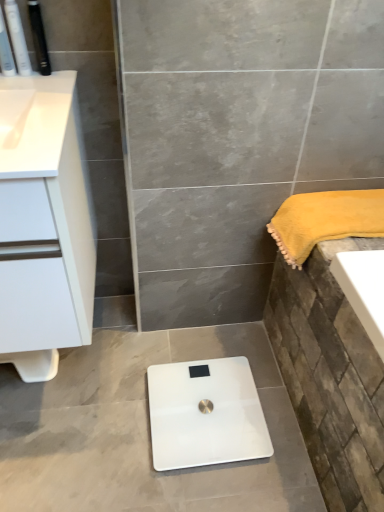
At what (x,y) coordinates should I click in order to perform the action: click on white glossy cabinet at upper left. Please return your answer as a coordinate pair (x, y). The image size is (384, 512). Looking at the image, I should click on (33, 123).

Measure the distance between white glossy cabinet at upper left and camera.

white glossy cabinet at upper left and camera are 71.74 centimeters apart.

Measure the distance between white plastic toothbrushes at upper left, the second toiletry in the left-to-right sequence, and camera.

The depth of white plastic toothbrushes at upper left, the second toiletry in the left-to-right sequence, is 37.50 inches.

Measure the distance between yellow plush towel at right and camera.

yellow plush towel at right and camera are 1.07 meters apart.

What do you see at coordinates (205, 414) in the screenshot? I see `white glossy scale at center` at bounding box center [205, 414].

This screenshot has width=384, height=512. What are the coordinates of `white glossy cabinet at upper left` in the screenshot? It's located at (33, 123).

Is white plastic toothbrushes at upper left, acting as the second toiletry starting from the right, smaller than black plastic toothbrush at upper left, positioned as the third toiletry in left-to-right order?

Actually, white plastic toothbrushes at upper left, acting as the second toiletry starting from the right, might be larger than black plastic toothbrush at upper left, positioned as the third toiletry in left-to-right order.

From the image's perspective, is white plastic toothbrushes at upper left, acting as the second toiletry starting from the right, on black plastic toothbrush at upper left, acting as the 1th toiletry starting from the right?

No, from the image's perspective, white plastic toothbrushes at upper left, acting as the second toiletry starting from the right, is not over black plastic toothbrush at upper left, acting as the 1th toiletry starting from the right.

Based on their positions, is white plastic toothbrushes at upper left, acting as the second toiletry starting from the right, located to the left or right of black plastic toothbrush at upper left, acting as the 1th toiletry starting from the right?

From the image, it's evident that white plastic toothbrushes at upper left, acting as the second toiletry starting from the right, is to the left of black plastic toothbrush at upper left, acting as the 1th toiletry starting from the right.

The width and height of the screenshot is (384, 512). Find the location of `toiletry above the white plastic toothbrushes at upper left, acting as the second toiletry starting from the right (from a real-world perspective)`. toiletry above the white plastic toothbrushes at upper left, acting as the second toiletry starting from the right (from a real-world perspective) is located at coordinates (39, 37).

Can you confirm if black plastic toothbrush at upper left, positioned as the third toiletry in left-to-right order, is positioned to the right of white glossy scale at center?

In fact, black plastic toothbrush at upper left, positioned as the third toiletry in left-to-right order, is to the left of white glossy scale at center.

Based on the photo, does black plastic toothbrush at upper left, acting as the 1th toiletry starting from the right, come behind white glossy scale at center?

No, it is in front of white glossy scale at center.

From a real-world perspective, is black plastic toothbrush at upper left, acting as the 1th toiletry starting from the right, beneath white glossy scale at center?

Incorrect, from a real-world perspective, black plastic toothbrush at upper left, acting as the 1th toiletry starting from the right, is higher than white glossy scale at center.

Could you tell me if black plastic toothbrush at upper left, acting as the 1th toiletry starting from the right, is facing white glossy scale at center?

No, black plastic toothbrush at upper left, acting as the 1th toiletry starting from the right, is not turned towards white glossy scale at center.

Who is taller, yellow plush towel at right or white glossy cabinet at upper left?

yellow plush towel at right.

Looking at this image, which is more to the right, yellow plush towel at right or white glossy cabinet at upper left?

yellow plush towel at right.

From a real-world perspective, does yellow plush towel at right stand above white glossy cabinet at upper left?

No, from a real-world perspective, yellow plush towel at right is not on top of white glossy cabinet at upper left.

Is white glossy cabinet at upper left positioned beyond the bounds of yellow plush towel at right?

Absolutely, white glossy cabinet at upper left is external to yellow plush towel at right.

Could you tell me if white glossy cabinet at upper left is facing yellow plush towel at right?

No, white glossy cabinet at upper left is not oriented towards yellow plush towel at right.

Considering the relative sizes of white glossy cabinet at upper left and yellow plush towel at right in the image provided, is white glossy cabinet at upper left smaller than yellow plush towel at right?

No.

From the image's perspective, does white matte cabinet at left appear lower than white glossy cabinet at upper left?

Indeed, from the image's perspective, white matte cabinet at left is shown beneath white glossy cabinet at upper left.

Is white matte cabinet at left bigger than white glossy cabinet at upper left?

Yes.

Looking at this image, would you say white matte cabinet at left contains white glossy cabinet at upper left?

Yes.

From a real-world perspective, is white matte cabinet at left located beneath black plastic toothbrush at upper left, positioned as the third toiletry in left-to-right order?

Correct, in the physical world, white matte cabinet at left is lower than black plastic toothbrush at upper left, positioned as the third toiletry in left-to-right order.

Is black plastic toothbrush at upper left, positioned as the third toiletry in left-to-right order, at the back of white matte cabinet at left?

That's not correct — white matte cabinet at left is not looking away from black plastic toothbrush at upper left, positioned as the third toiletry in left-to-right order.

Is white matte cabinet at left positioned before black plastic toothbrush at upper left, positioned as the third toiletry in left-to-right order?

Yes, white matte cabinet at left is closer to the camera.

Which of these two, white matte cabinet at left or black plastic toothbrush at upper left, acting as the 1th toiletry starting from the right, is thinner?

black plastic toothbrush at upper left, acting as the 1th toiletry starting from the right, is thinner.

Based on the photo, measure the distance from white glossy cabinet at upper left to matte black toothbrush at upper left, positioned as the first toiletry in left-to-right order.

A distance of 9.26 inches exists between white glossy cabinet at upper left and matte black toothbrush at upper left, positioned as the first toiletry in left-to-right order.

Based on the photo, is white glossy cabinet at upper left aimed at matte black toothbrush at upper left, the third toiletry positioned from the right?

No.

From a real-world perspective, between white glossy cabinet at upper left and matte black toothbrush at upper left, positioned as the first toiletry in left-to-right order, who is vertically higher?

matte black toothbrush at upper left, positioned as the first toiletry in left-to-right order, from a real-world perspective.

The height and width of the screenshot is (512, 384). In order to click on toiletry that is on the right side of white plastic toothbrushes at upper left, the second toiletry in the left-to-right sequence in this screenshot , I will do `click(39, 37)`.

There is a white glossy scale at center. Where is `the 3rd toiletry above it (from a real-world perspective)`? This screenshot has height=512, width=384. the 3rd toiletry above it (from a real-world perspective) is located at coordinates (39, 37).

Estimate the real-world distances between objects in this image. Which object is further from white plastic toothbrushes at upper left, acting as the second toiletry starting from the right, white glossy cabinet at upper left or black plastic toothbrush at upper left, positioned as the third toiletry in left-to-right order?

white glossy cabinet at upper left is positioned further to the anchor white plastic toothbrushes at upper left, acting as the second toiletry starting from the right.

Looking at this image, estimate the real-world distances between objects in this image. Which object is closer to matte black toothbrush at upper left, positioned as the first toiletry in left-to-right order, white matte cabinet at left or white glossy cabinet at upper left?

The object closer to matte black toothbrush at upper left, positioned as the first toiletry in left-to-right order, is white glossy cabinet at upper left.

Considering their positions, is white glossy scale at center positioned further to white glossy cabinet at upper left than black plastic toothbrush at upper left, positioned as the third toiletry in left-to-right order?

white glossy scale at center lies further to white glossy cabinet at upper left than the other object.

Based on their spatial positions, is white glossy cabinet at upper left or black plastic toothbrush at upper left, positioned as the third toiletry in left-to-right order, closer to matte black toothbrush at upper left, the third toiletry positioned from the right?

The object closer to matte black toothbrush at upper left, the third toiletry positioned from the right, is black plastic toothbrush at upper left, positioned as the third toiletry in left-to-right order.

Looking at the image, which one is located closer to white glossy scale at center, white glossy cabinet at upper left or yellow plush towel at right?

yellow plush towel at right is positioned closer to the anchor white glossy scale at center.

Looking at the image, which one is located closer to white plastic toothbrushes at upper left, the second toiletry in the left-to-right sequence, white glossy scale at center or white glossy cabinet at upper left?

Among the two, white glossy cabinet at upper left is located nearer to white plastic toothbrushes at upper left, the second toiletry in the left-to-right sequence.

Based on their spatial positions, is white matte cabinet at left or yellow plush towel at right further from white glossy scale at center?

Based on the image, white matte cabinet at left appears to be further to white glossy scale at center.

Based on their spatial positions, is white matte cabinet at left or white plastic toothbrushes at upper left, acting as the second toiletry starting from the right, further from black plastic toothbrush at upper left, acting as the 1th toiletry starting from the right?

white matte cabinet at left is positioned further to the anchor black plastic toothbrush at upper left, acting as the 1th toiletry starting from the right.

Locate an element on the screen. The width and height of the screenshot is (384, 512). bath towel between matte black toothbrush at upper left, positioned as the first toiletry in left-to-right order, and white glossy scale at center vertically is located at coordinates (325, 220).

I want to click on toiletry between white plastic toothbrushes at upper left, the second toiletry in the left-to-right sequence, and white matte cabinet at left from top to bottom, so click(5, 50).

At what (x,y) coordinates should I click in order to perform the action: click on toiletry between white plastic toothbrushes at upper left, acting as the second toiletry starting from the right, and white glossy scale at center from top to bottom. Please return your answer as a coordinate pair (x, y). The width and height of the screenshot is (384, 512). Looking at the image, I should click on tap(5, 50).

Locate an element on the screen. The width and height of the screenshot is (384, 512). counter top between white plastic toothbrushes at upper left, acting as the second toiletry starting from the right, and white glossy scale at center, in the vertical direction is located at coordinates (33, 123).